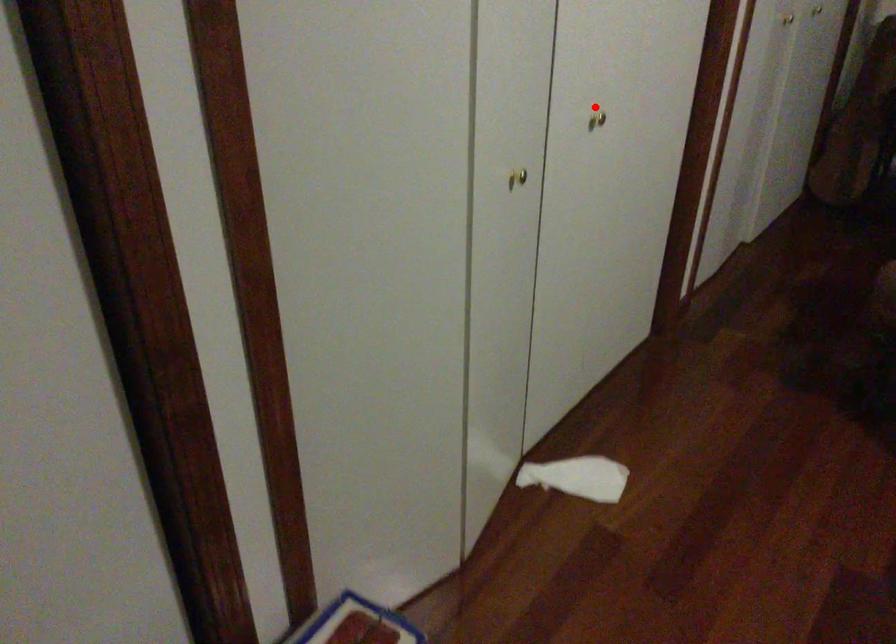
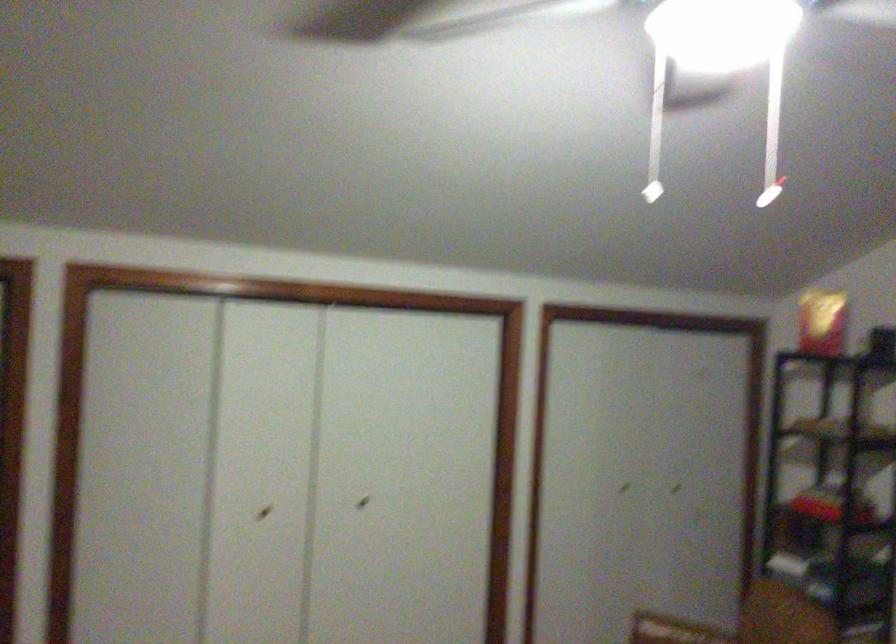
Question: I am providing you with two images of the same scene from different viewpoints. In image1, a red point is highlighted. Considering the same 3D point in image2, which of the following is correct?

Choices:
 (A) It is closer
 (B) It is farther

Answer: (B)